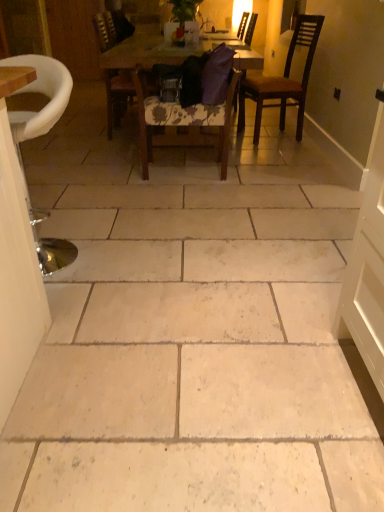
Question: Relative to metallic silver stool at left, which is the first chair from front to back, is wooden door at left in front or behind?

Choices:
 (A) behind
 (B) front

Answer: (A)

Question: Is wooden door at left taller or shorter than metallic silver stool at left, which is the first chair from front to back?

Choices:
 (A) tall
 (B) short

Answer: (A)

Question: Based on their relative distances, which object is nearer to the floral fabric chair at center, which is counted as the fourth chair, starting from the back?

Choices:
 (A) purple fabric chair at center, placed as the first chair when sorted from back to front
 (B) wooden door at left
 (C) wooden table at center
 (D) dark brown wooden chair at upper right, the 3th chair viewed from the back
 (E) metallic silver stool at left, which is the 5th chair from back to front

Answer: (C)

Question: Estimate the real-world distances between objects in this image. Which object is farther from the wooden table at center?

Choices:
 (A) floral fabric chair at center, the 2th chair viewed from the front
 (B) purple fabric chair at center, placed as the first chair when sorted from back to front
 (C) dark brown wooden chair at upper right, the third chair when ordered from front to back
 (D) wooden chair at center, the 2th chair when ordered from back to front
 (E) metallic silver stool at left, which is the 5th chair from back to front

Answer: (E)